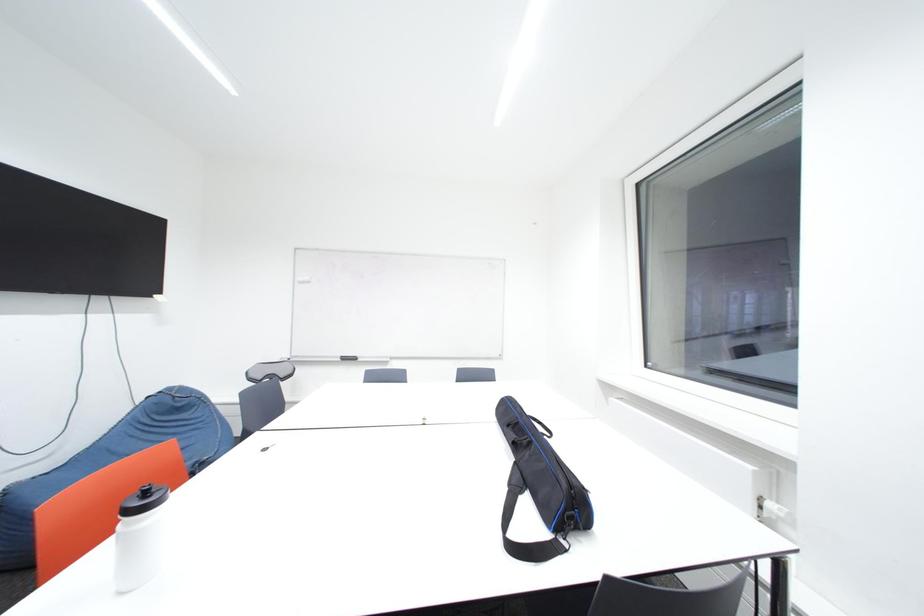
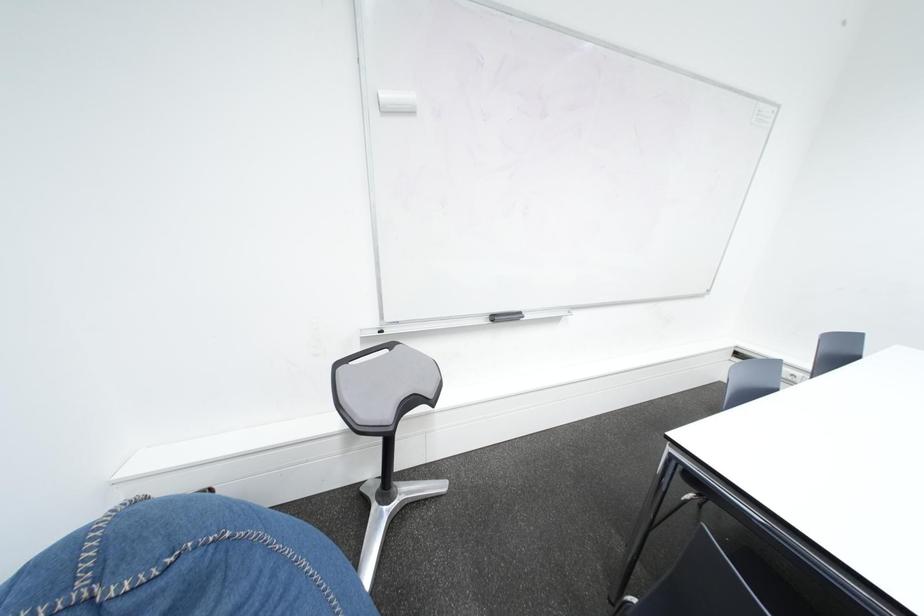
In a continuous first-person perspective shot, in which direction is the camera moving?

The cameraman walked toward left, forward.